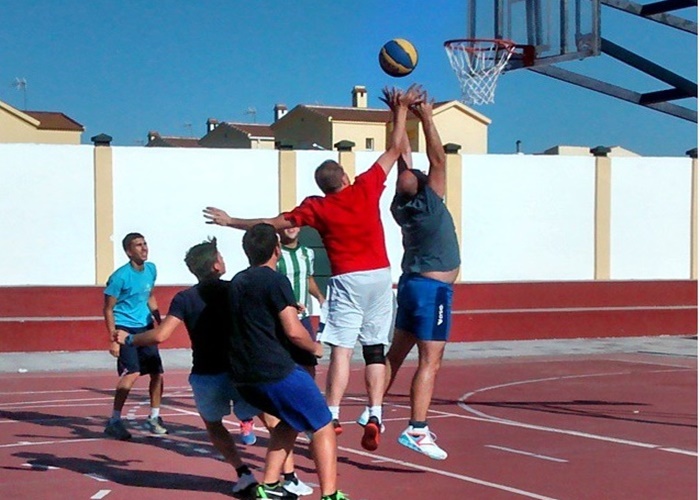
Image resolution: width=700 pixels, height=500 pixels. I want to click on chimney, so click(360, 94), click(283, 108), click(213, 124), click(148, 134).